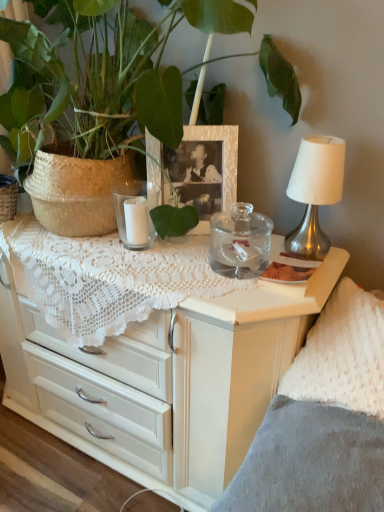
Question: Does silver metallic table lamp at upper right have a greater height compared to transparent glass jar at center, marked as the second candle holder in a left-to-right arrangement?

Choices:
 (A) yes
 (B) no

Answer: (A)

Question: Would you say silver metallic table lamp at upper right is a long distance from transparent glass jar at center, positioned as the 1th candle holder in right-to-left order?

Choices:
 (A) yes
 (B) no

Answer: (B)

Question: From a real-world perspective, is silver metallic table lamp at upper right positioned under transparent glass jar at center, positioned as the 1th candle holder in right-to-left order, based on gravity?

Choices:
 (A) yes
 (B) no

Answer: (B)

Question: Can transparent glass jar at center, marked as the second candle holder in a left-to-right arrangement, be found inside silver metallic table lamp at upper right?

Choices:
 (A) yes
 (B) no

Answer: (B)

Question: From a real-world perspective, is silver metallic table lamp at upper right physically above transparent glass jar at center, positioned as the 1th candle holder in right-to-left order?

Choices:
 (A) no
 (B) yes

Answer: (B)

Question: Could you tell me if silver metallic table lamp at upper right is turned towards transparent glass jar at center, marked as the second candle holder in a left-to-right arrangement?

Choices:
 (A) no
 (B) yes

Answer: (A)

Question: Considering the relative sizes of white glass candle at center, placed as the second candle holder when sorted from right to left, and gray fabric at lower right in the image provided, is white glass candle at center, placed as the second candle holder when sorted from right to left, taller than gray fabric at lower right?

Choices:
 (A) yes
 (B) no

Answer: (A)

Question: From a real-world perspective, is white glass candle at center, placed as the second candle holder when sorted from right to left, over gray fabric at lower right?

Choices:
 (A) no
 (B) yes

Answer: (B)

Question: Can you confirm if white glass candle at center, acting as the 1th candle holder starting from the left, is bigger than gray fabric at lower right?

Choices:
 (A) no
 (B) yes

Answer: (A)

Question: Can you confirm if white glass candle at center, acting as the 1th candle holder starting from the left, is thinner than gray fabric at lower right?

Choices:
 (A) yes
 (B) no

Answer: (A)

Question: Does white glass candle at center, placed as the second candle holder when sorted from right to left, appear on the right side of gray fabric at lower right?

Choices:
 (A) yes
 (B) no

Answer: (B)

Question: Can you confirm if white glass candle at center, placed as the second candle holder when sorted from right to left, is positioned to the left of gray fabric at lower right?

Choices:
 (A) yes
 (B) no

Answer: (A)

Question: Is white textured picture frame at center facing away from white glass candle at center, placed as the second candle holder when sorted from right to left?

Choices:
 (A) yes
 (B) no

Answer: (B)